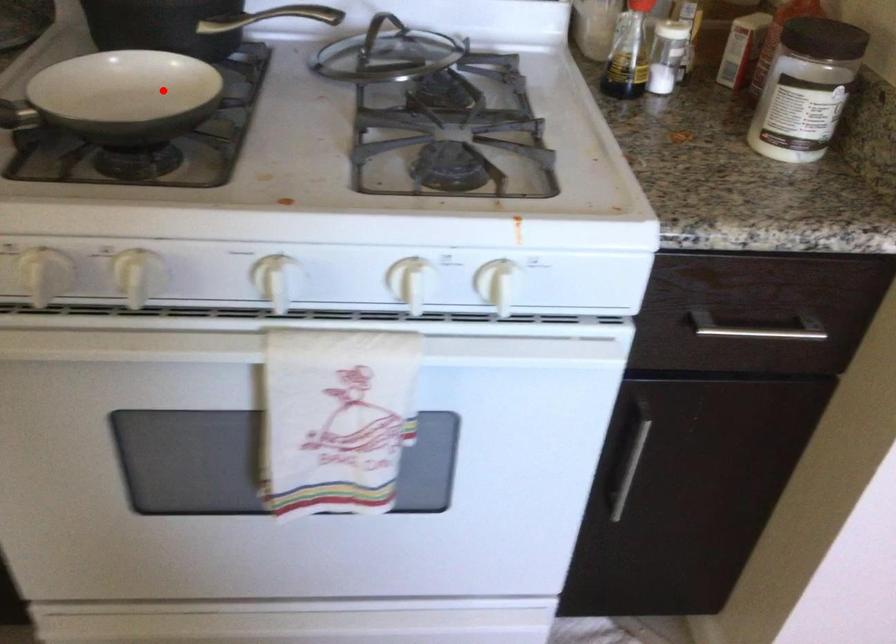
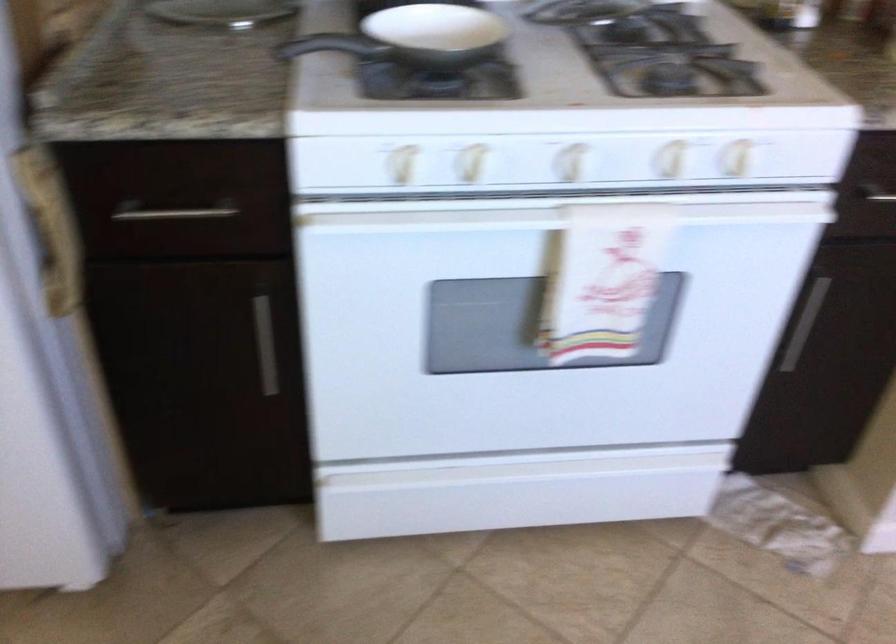
Locate, in the second image, the point that corresponds to the highlighted location in the first image.

(436, 33)